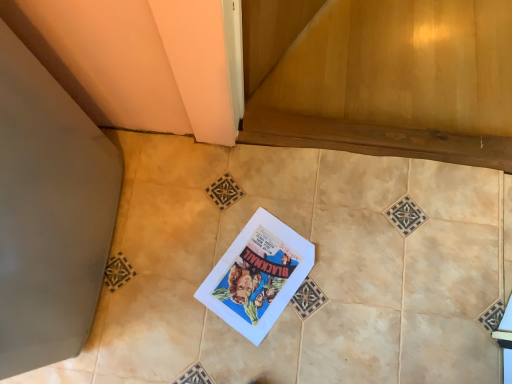
Question: From the image's perspective, is wooden at lower center on matte paper comic book at center?

Choices:
 (A) yes
 (B) no

Answer: (A)

Question: Can you confirm if wooden at lower center is positioned to the right of matte paper comic book at center?

Choices:
 (A) no
 (B) yes

Answer: (B)

Question: Does wooden at lower center come in front of matte paper comic book at center?

Choices:
 (A) no
 (B) yes

Answer: (A)

Question: Can you confirm if wooden at lower center is positioned to the left of matte paper comic book at center?

Choices:
 (A) yes
 (B) no

Answer: (B)

Question: Can you confirm if wooden at lower center is taller than matte paper comic book at center?

Choices:
 (A) yes
 (B) no

Answer: (A)

Question: Is wooden at lower center positioned beyond the bounds of matte paper comic book at center?

Choices:
 (A) yes
 (B) no

Answer: (A)

Question: From the image's perspective, would you say matte paper comic book at center is shown under beige ceramic tile at center?

Choices:
 (A) yes
 (B) no

Answer: (A)

Question: Does matte paper comic book at center appear on the left side of beige ceramic tile at center?

Choices:
 (A) no
 (B) yes

Answer: (B)

Question: From a real-world perspective, is matte paper comic book at center physically above beige ceramic tile at center?

Choices:
 (A) yes
 (B) no

Answer: (B)

Question: Is matte paper comic book at center placed right next to beige ceramic tile at center?

Choices:
 (A) yes
 (B) no

Answer: (B)

Question: Considering the relative sizes of matte paper comic book at center and beige ceramic tile at center in the image provided, is matte paper comic book at center shorter than beige ceramic tile at center?

Choices:
 (A) yes
 (B) no

Answer: (A)

Question: From a real-world perspective, is matte paper comic book at center under beige ceramic tile at center?

Choices:
 (A) yes
 (B) no

Answer: (A)

Question: Is wooden at lower center facing towards beige ceramic tile at center?

Choices:
 (A) yes
 (B) no

Answer: (A)